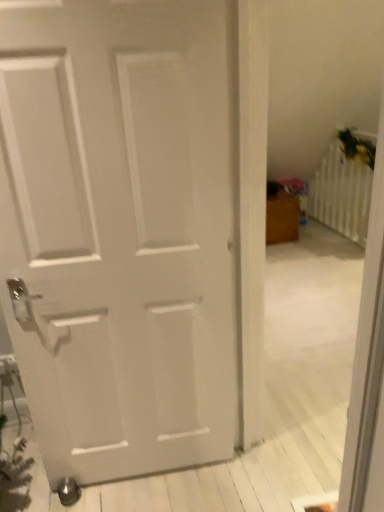
At what (x,y) coordinates should I click in order to perform the action: click on white plastic radiator at upper right. Please return your answer as a coordinate pair (x, y). Looking at the image, I should click on tap(341, 194).

The image size is (384, 512). What do you see at coordinates (341, 194) in the screenshot? I see `white plastic radiator at upper right` at bounding box center [341, 194].

Find the location of `white matte door at center`. white matte door at center is located at coordinates (118, 231).

The width and height of the screenshot is (384, 512). What do you see at coordinates (118, 231) in the screenshot? I see `white matte door at center` at bounding box center [118, 231].

Image resolution: width=384 pixels, height=512 pixels. In order to click on white plastic radiator at upper right in this screenshot , I will do `click(341, 194)`.

Can you confirm if white plastic radiator at upper right is positioned to the right of white matte door at center?

Indeed, white plastic radiator at upper right is positioned on the right side of white matte door at center.

In the image, is white plastic radiator at upper right positioned in front of or behind white matte door at center?

white plastic radiator at upper right is behind white matte door at center.

Is point (359, 197) farther from camera compared to point (110, 408)?

Yes, point (359, 197) is farther from viewer.

From the image's perspective, which one is positioned higher, white plastic radiator at upper right or white matte door at center?

white plastic radiator at upper right, from the image's perspective.

From a real-world perspective, which is physically above, white plastic radiator at upper right or white matte door at center?

From a 3D spatial view, white matte door at center is above.

Considering the sizes of white plastic radiator at upper right and white matte door at center in the image, is white plastic radiator at upper right wider or thinner than white matte door at center?

white plastic radiator at upper right is thinner than white matte door at center.

Does white plastic radiator at upper right have a lesser height compared to white matte door at center?

Correct, white plastic radiator at upper right is not as tall as white matte door at center.

Is white plastic radiator at upper right bigger or smaller than white matte door at center?

In the image, white plastic radiator at upper right appears to be smaller than white matte door at center.

Choose the correct answer: Is white plastic radiator at upper right inside white matte door at center or outside it?

The correct answer is: outside.

Is white plastic radiator at upper right with white matte door at center?

No, white plastic radiator at upper right is not with white matte door at center.

Is white plastic radiator at upper right facing away from white matte door at center?

No.

What's the angular difference between white plastic radiator at upper right and white matte door at center's facing directions?

The facing directions of white plastic radiator at upper right and white matte door at center are 85.9 degrees apart.

The height and width of the screenshot is (512, 384). Identify the location of radiator to the right of white matte door at center. (341, 194).

Between white matte door at center and white plastic radiator at upper right, which one appears on the left side from the viewer's perspective?

white matte door at center is more to the left.

Considering the relative positions of white matte door at center and white plastic radiator at upper right in the image provided, is white matte door at center behind white plastic radiator at upper right?

No, it is not.

Which is behind, point (147, 262) or point (352, 182)?

Point (352, 182)

From the image's perspective, which is below, white matte door at center or white plastic radiator at upper right?

From the image's view, white matte door at center is below.

From a real-world perspective, which object stands above the other?

white matte door at center.

Between white matte door at center and white plastic radiator at upper right, which one has larger width?

Wider between the two is white matte door at center.

Considering the relative sizes of white matte door at center and white plastic radiator at upper right in the image provided, is white matte door at center shorter than white plastic radiator at upper right?

No, white matte door at center is not shorter than white plastic radiator at upper right.

Is white matte door at center bigger than white plastic radiator at upper right?

Yes.

Is white plastic radiator at upper right completely or partially inside white matte door at center?

That's incorrect, white plastic radiator at upper right is not inside white matte door at center.

Is there a large distance between white matte door at center and white plastic radiator at upper right?

Yes, white matte door at center and white plastic radiator at upper right are quite far apart.

Is white plastic radiator at upper right at the back of white matte door at center?

No, white matte door at center's orientation is not away from white plastic radiator at upper right.

In order to click on radiator below the white matte door at center (from a real-world perspective) in this screenshot , I will do `click(341, 194)`.

This screenshot has height=512, width=384. In order to click on radiator above the white matte door at center (from the image's perspective) in this screenshot , I will do `click(341, 194)`.

Find the location of a particular element. This screenshot has height=512, width=384. door located above the white plastic radiator at upper right (from a real-world perspective) is located at coordinates (118, 231).